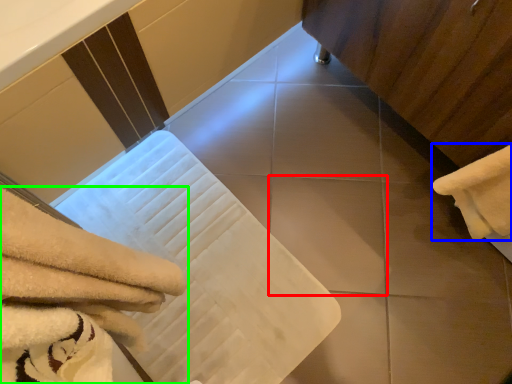
Question: Which is nearer to the tile (highlighted by a red box)? towel (highlighted by a blue box) or towel (highlighted by a green box).

Choices:
 (A) towel
 (B) towel

Answer: (A)